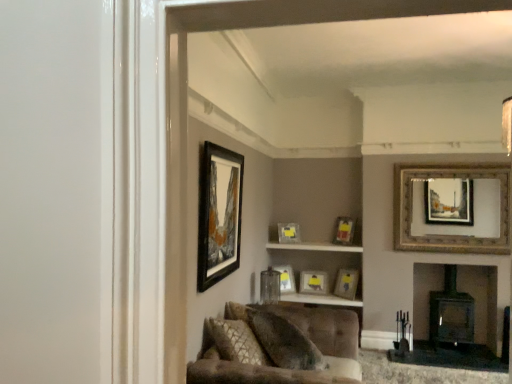
Question: Is matte gold picture frame at center, acting as the fifth picture frame starting from the left, positioned with its back to black matte picture frame at upper center, the 7th picture frame when ordered from back to front?

Choices:
 (A) no
 (B) yes

Answer: (A)

Question: Is matte gold picture frame at center, the 3th picture frame from the right, bigger than black matte picture frame at upper center, which ranks as the first picture frame in front-to-back order?

Choices:
 (A) no
 (B) yes

Answer: (A)

Question: From the image's perspective, is matte gold picture frame at center, which is counted as the 4th picture frame, starting from the back, over black matte picture frame at upper center, marked as the first picture frame in a left-to-right arrangement?

Choices:
 (A) no
 (B) yes

Answer: (A)

Question: From the image's perspective, is matte gold picture frame at center, acting as the fifth picture frame starting from the left, under black matte picture frame at upper center, acting as the 7th picture frame starting from the right?

Choices:
 (A) no
 (B) yes

Answer: (B)

Question: Does matte gold picture frame at center, the 3th picture frame from the right, have a greater height compared to black matte picture frame at upper center, marked as the first picture frame in a left-to-right arrangement?

Choices:
 (A) yes
 (B) no

Answer: (B)

Question: Considering the positions of matte gold picture frame at center, the 3th picture frame from the right, and matte gold picture frame at center, the seventh picture frame positioned from the front, in the image, is matte gold picture frame at center, the 3th picture frame from the right, wider or thinner than matte gold picture frame at center, the seventh picture frame positioned from the front,?

Choices:
 (A) thin
 (B) wide

Answer: (B)

Question: From the image's perspective, relative to matte gold picture frame at center, the seventh picture frame positioned from the front, is matte gold picture frame at center, positioned as the 4th picture frame in front-to-back order, above or below?

Choices:
 (A) above
 (B) below

Answer: (A)

Question: Considering the relative positions of matte gold picture frame at center, the 3th picture frame from the right, and matte gold picture frame at center, the seventh picture frame positioned from the front, in the image provided, is matte gold picture frame at center, the 3th picture frame from the right, to the left or to the right of matte gold picture frame at center, the seventh picture frame positioned from the front,?

Choices:
 (A) right
 (B) left

Answer: (A)

Question: From a real-world perspective, relative to matte gold picture frame at center, which is counted as the 5th picture frame, starting from the right, is matte gold picture frame at center, acting as the fifth picture frame starting from the left, vertically above or below?

Choices:
 (A) above
 (B) below

Answer: (A)

Question: In terms of width, does matte glass cabinet at center look wider or thinner when compared to wooden picture frame at center, the 2th picture frame in the right-to-left sequence?

Choices:
 (A) wide
 (B) thin

Answer: (A)

Question: In terms of size, does matte glass cabinet at center appear bigger or smaller than wooden picture frame at center, the 2th picture frame in the right-to-left sequence?

Choices:
 (A) big
 (B) small

Answer: (A)

Question: Is matte glass cabinet at center inside the boundaries of wooden picture frame at center, the sixth picture frame in the left-to-right sequence, or outside?

Choices:
 (A) inside
 (B) outside

Answer: (B)

Question: From the image's perspective, is matte glass cabinet at center positioned above or below wooden picture frame at center, the sixth picture frame in the left-to-right sequence?

Choices:
 (A) below
 (B) above

Answer: (B)

Question: Is tufted fabric couch at lower center taller or shorter than black matte picture frame at upper center, which ranks as the first picture frame in front-to-back order?

Choices:
 (A) short
 (B) tall

Answer: (A)

Question: Considering the positions of tufted fabric couch at lower center and black matte picture frame at upper center, which ranks as the first picture frame in front-to-back order, in the image, is tufted fabric couch at lower center wider or thinner than black matte picture frame at upper center, which ranks as the first picture frame in front-to-back order,?

Choices:
 (A) wide
 (B) thin

Answer: (A)